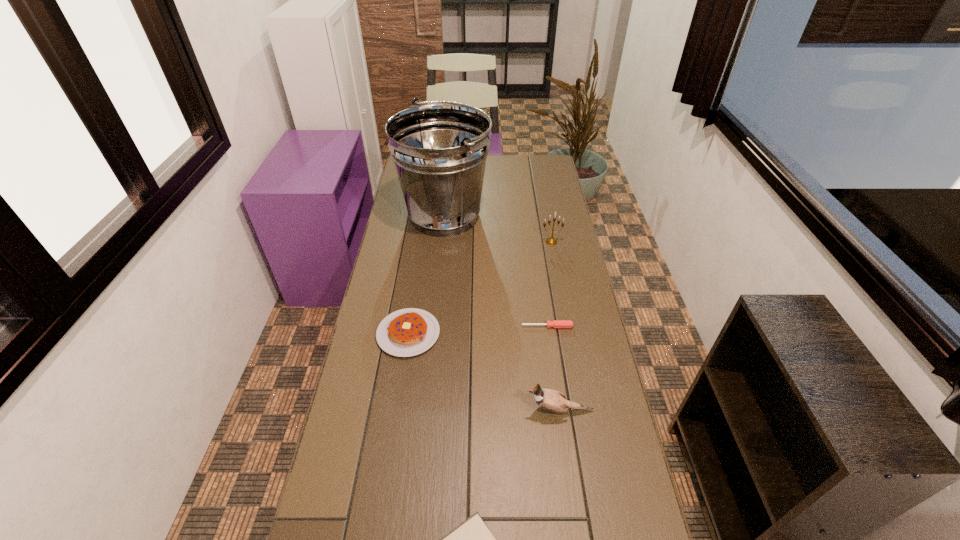
Where is `free spot between the bucket and the candelabrum`? This screenshot has width=960, height=540. free spot between the bucket and the candelabrum is located at coordinates (498, 228).

Locate an element on the screen. The image size is (960, 540). vacant point located between the bucket and the screwdriver is located at coordinates [496, 271].

You are a GUI agent. You are given a task and a screenshot of the screen. Output one action in this format:
    pyautogui.click(x=<x>, y=<y>)
    Task: Click on the free space between the screwdriver and the fifth farthest object
    This screenshot has height=540, width=960.
    Given the screenshot: What is the action you would take?
    pyautogui.click(x=553, y=369)

Find the location of a particular element. empty space between the screwdriver and the candelabrum is located at coordinates (549, 284).

Identify the location of vacant area that lies between the candelabrum and the tallest object. (498, 228).

Locate an element on the screen. This screenshot has height=540, width=960. free space between the fourth tallest object and the tallest object is located at coordinates (426, 274).

You are a GUI agent. You are given a task and a screenshot of the screen. Output one action in this format:
    pyautogui.click(x=<x>, y=<y>)
    Task: Click on the free space between the candelabrum and the third shortest object
    
    Given the screenshot: What is the action you would take?
    click(x=480, y=287)

Find the location of a particular element. The width and height of the screenshot is (960, 540). vacant space in between the fourth tallest object and the candelabrum is located at coordinates (480, 287).

Locate which object is the fourth closest to the candelabrum. Please provide its 2D coordinates. Your answer should be formatted as a tuple, i.e. [(x, y)], where the tuple contains the x and y coordinates of a point satisfying the conditions above.

[(551, 400)]

Point out which object is positioned as the third nearest to the screwdriver. Please provide its 2D coordinates. Your answer should be formatted as a tuple, i.e. [(x, y)], where the tuple contains the x and y coordinates of a point satisfying the conditions above.

[(551, 241)]